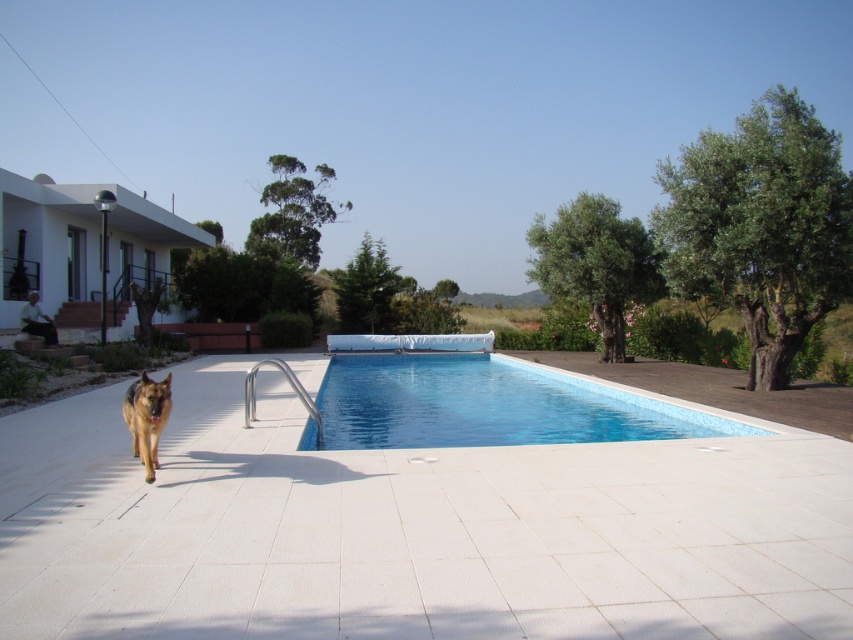
Who is positioned more to the left, blue smooth pool at center or golden brown fur dog at center?

golden brown fur dog at center

Who is more forward, (578, 408) or (151, 416)?

Positioned in front is point (151, 416).

Locate an element on the screen. The image size is (853, 640). blue smooth pool at center is located at coordinates (485, 406).

You are a GUI agent. You are given a task and a screenshot of the screen. Output one action in this format:
    pyautogui.click(x=<x>, y=<y>)
    Task: Click on the blue smooth pool at center
    
    Given the screenshot: What is the action you would take?
    pyautogui.click(x=485, y=406)